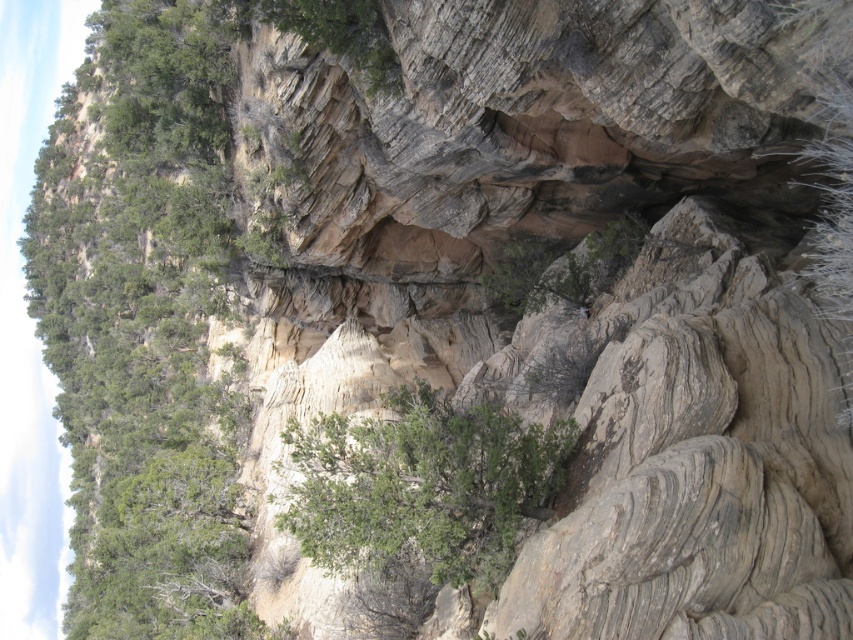
Question: Is green leafy tree at upper left smaller than green leafy shrub at center?

Choices:
 (A) no
 (B) yes

Answer: (A)

Question: Is green leafy tree at upper left thinner than green leafy shrub at center?

Choices:
 (A) no
 (B) yes

Answer: (A)

Question: Which point is farther to the camera?

Choices:
 (A) green leafy tree at upper left
 (B) green leafy shrub at center

Answer: (A)

Question: Which of the following is the closest to the observer?

Choices:
 (A) green leafy tree at upper left
 (B) green leafy shrub at center

Answer: (B)

Question: Is the position of green leafy tree at upper left more distant than that of green leafy shrub at center?

Choices:
 (A) yes
 (B) no

Answer: (A)